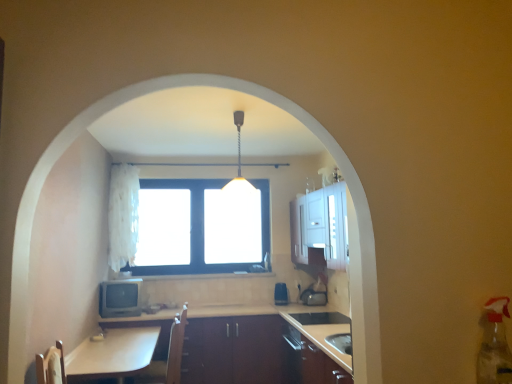
The image size is (512, 384). In order to click on white glossy table at lower left in this screenshot , I will do `click(112, 355)`.

Describe the element at coordinates (168, 356) in the screenshot. I see `brown leather swivel chair at lower left` at that location.

Describe the element at coordinates (252, 350) in the screenshot. Image resolution: width=512 pixels, height=384 pixels. I see `wooden at center` at that location.

Locate an element on the screen. Image resolution: width=512 pixels, height=384 pixels. matte gray television at lower left, the 1th appliance positioned from the front is located at coordinates (119, 298).

Image resolution: width=512 pixels, height=384 pixels. Identify the location of blue plastic toaster at center, the first appliance viewed from the back. (281, 294).

Locate an element on the screen. The height and width of the screenshot is (384, 512). clear glass window at center is located at coordinates (190, 231).

Can you confirm if matte gray television at lower left, the second appliance when ordered from right to left, is taller than white glossy table at lower left?

No, matte gray television at lower left, the second appliance when ordered from right to left, is not taller than white glossy table at lower left.

Does matte gray television at lower left, which is the second appliance in back-to-front order, have a greater width compared to white glossy table at lower left?

No.

Is white glossy table at lower left completely or partially inside matte gray television at lower left, the 1th appliance positioned from the front?

Definitely not — white glossy table at lower left is not inside matte gray television at lower left, the 1th appliance positioned from the front.

Is matte gray television at lower left, placed as the first appliance when sorted from left to right, not near white glossy table at lower left?

They are positioned close to each other.

Which point is more distant from viewer, (239,172) or (157,372)?

Point (239,172)

Would you say metallic pendant light at center is a long distance from brown leather swivel chair at lower left?

Yes, metallic pendant light at center and brown leather swivel chair at lower left are located far from each other.

You are a GUI agent. You are given a task and a screenshot of the screen. Output one action in this format:
    pyautogui.click(x=<x>, y=<y>)
    Task: Click on the light fixture that is above the brown leather swivel chair at lower left (from a real-world perspective)
    
    Given the screenshot: What is the action you would take?
    pyautogui.click(x=239, y=167)

Based on their sizes in the image, would you say metallic pendant light at center is bigger or smaller than brown leather swivel chair at lower left?

In the image, metallic pendant light at center appears to be smaller than brown leather swivel chair at lower left.

Is clear glass window at center positioned far away from metallic pendant light at center?

Yes, clear glass window at center is far from metallic pendant light at center.

How distant is clear glass window at center from metallic pendant light at center?

They are 3.82 feet apart.

Which of these two, clear glass window at center or metallic pendant light at center, is bigger?

Bigger between the two is clear glass window at center.

At what (x,y) coordinates should I click in order to perform the action: click on window lying below the metallic pendant light at center (from the image's perspective). Please return your answer as a coordinate pair (x, y). Looking at the image, I should click on (190, 231).

Is metallic pendant light at center placed right next to white fluffy curtain at upper left?

No, metallic pendant light at center is not in contact with white fluffy curtain at upper left.

Considering the relative sizes of metallic pendant light at center and white fluffy curtain at upper left in the image provided, is metallic pendant light at center shorter than white fluffy curtain at upper left?

Correct, metallic pendant light at center is not as tall as white fluffy curtain at upper left.

From a real-world perspective, who is located higher, metallic pendant light at center or white fluffy curtain at upper left?

metallic pendant light at center, from a real-world perspective.

Does metallic pendant light at center turn towards white fluffy curtain at upper left?

No, metallic pendant light at center is not aimed at white fluffy curtain at upper left.

Between clear glass window at center and white fluffy curtain at upper left, which one has larger width?

white fluffy curtain at upper left is wider.

Consider the image. From a real-world perspective, which is physically below, clear glass window at center or white fluffy curtain at upper left?

clear glass window at center is physically lower.

Based on the photo, considering their positions, is clear glass window at center located in front of or behind white fluffy curtain at upper left?

Clearly, clear glass window at center is behind white fluffy curtain at upper left.

Would you say clear glass window at center contains white fluffy curtain at upper left?

No, white fluffy curtain at upper left is not inside clear glass window at center.

This screenshot has height=384, width=512. Find the location of `table in front of the wooden at center`. table in front of the wooden at center is located at coordinates (112, 355).

From a real-world perspective, between white glossy table at lower left and wooden at center, who is vertically lower?

From a 3D spatial view, wooden at center is below.

Is point (128, 362) less distant than point (199, 338)?

Yes, it is.

In terms of width, does white glossy table at lower left look wider or thinner when compared to wooden at center?

In the image, white glossy table at lower left appears to be wider than wooden at center.

What's the angular difference between metallic pendant light at center and clear glass window at center's facing directions?

metallic pendant light at center and clear glass window at center are facing 1.28 degrees away from each other.

Does point (234, 179) come in front of point (265, 190)?

Yes.

From the picture: In the image, is metallic pendant light at center positioned in front of or behind clear glass window at center?

metallic pendant light at center is positioned closer to the viewer than clear glass window at center.

This screenshot has width=512, height=384. I want to click on light fixture lying on the right of clear glass window at center, so click(x=239, y=167).

The width and height of the screenshot is (512, 384). I want to click on the 2nd appliance above the white glossy table at lower left (from the image's perspective), so 119,298.

Identify the location of light fixture on the right side of brown leather swivel chair at lower left. The image size is (512, 384). (239, 167).

Looking at this image, when comparing their distances from blue plastic toaster at center, the first appliance viewed from the back, does white fluffy curtain at upper left or wooden at center seem further?

white fluffy curtain at upper left is positioned further to the anchor blue plastic toaster at center, the first appliance viewed from the back.

From the image, which object appears to be nearer to brown leather swivel chair at lower left, clear glass window at center or metallic pendant light at center?

The object closer to brown leather swivel chair at lower left is metallic pendant light at center.

Looking at the image, which one is located closer to wooden at center, white fluffy curtain at upper left or metallic pendant light at center?

white fluffy curtain at upper left is closer to wooden at center.

When comparing their distances from white fluffy curtain at upper left, does wooden at center or blue plastic toaster at center, placed as the second appliance when sorted from left to right, seem closer?

The object closer to white fluffy curtain at upper left is wooden at center.

Estimate the real-world distances between objects in this image. Which object is closer to wooden at center, matte gray television at lower left, the second appliance when ordered from right to left, or blue plastic toaster at center, the first appliance viewed from the back?

matte gray television at lower left, the second appliance when ordered from right to left, is closer to wooden at center.

Which object lies further to the anchor point brown leather swivel chair at lower left, white fluffy curtain at upper left or metallic pendant light at center?

white fluffy curtain at upper left lies further to brown leather swivel chair at lower left than the other object.

Based on their spatial positions, is brown leather swivel chair at lower left or blue plastic toaster at center, the 2th appliance positioned from the front, further from clear glass window at center?

The object further to clear glass window at center is brown leather swivel chair at lower left.

Considering their positions, is blue plastic toaster at center, arranged as the first appliance when viewed from the right, positioned further to white glossy table at lower left than white fluffy curtain at upper left?

blue plastic toaster at center, arranged as the first appliance when viewed from the right, lies further to white glossy table at lower left than the other object.

Find the location of `swivel chair between metallic pendant light at center and wooden at center in the vertical direction`. swivel chair between metallic pendant light at center and wooden at center in the vertical direction is located at coordinates (168, 356).

Where is `swivel chair between white glossy table at lower left and matte gray television at lower left, placed as the first appliance when sorted from left to right, along the z-axis`? The width and height of the screenshot is (512, 384). swivel chair between white glossy table at lower left and matte gray television at lower left, placed as the first appliance when sorted from left to right, along the z-axis is located at coordinates (168, 356).

Find the location of `swivel chair between metallic pendant light at center and white glossy table at lower left from top to bottom`. swivel chair between metallic pendant light at center and white glossy table at lower left from top to bottom is located at coordinates (168, 356).

The width and height of the screenshot is (512, 384). In order to click on countertop between matte gray television at lower left, the second appliance when ordered from right to left, and blue plastic toaster at center, the 2th appliance positioned from the front in this screenshot , I will do `click(252, 350)`.